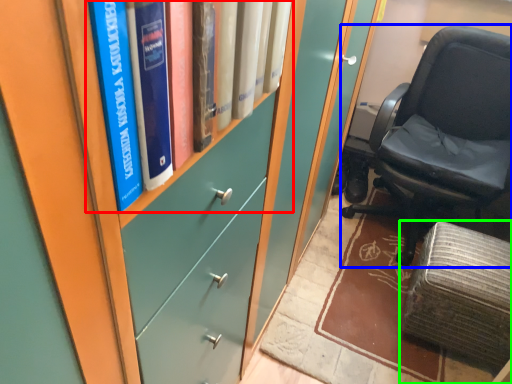
Question: Which is nearer to the book (highlighted by a red box)? chair (highlighted by a blue box) or furniture (highlighted by a green box).

Choices:
 (A) chair
 (B) furniture

Answer: (B)